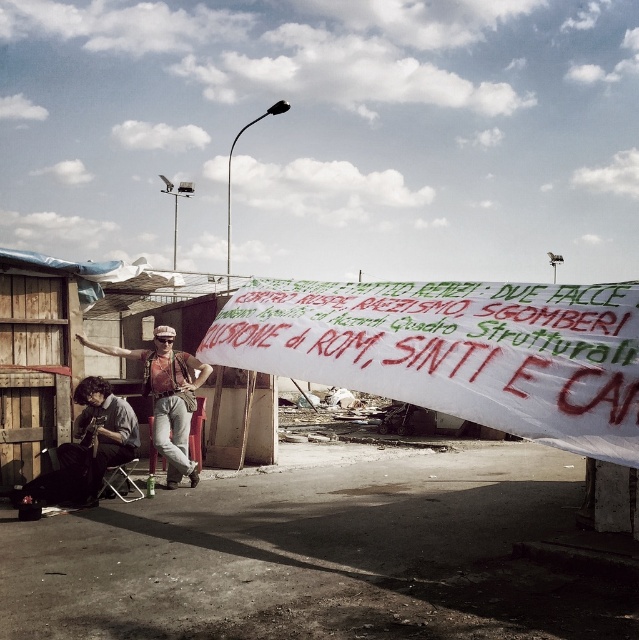
Question: Is white paper banner at center to the right of denim jacket at lower left from the viewer's perspective?

Choices:
 (A) no
 (B) yes

Answer: (B)

Question: Can you confirm if white paper banner at center is positioned below denim jacket at lower left?

Choices:
 (A) yes
 (B) no

Answer: (B)

Question: Is white paper banner at center closer to the viewer compared to denim jacket at lower left?

Choices:
 (A) no
 (B) yes

Answer: (B)

Question: Which point appears farthest from the camera in this image?

Choices:
 (A) (528, 378)
 (B) (111, 349)

Answer: (B)